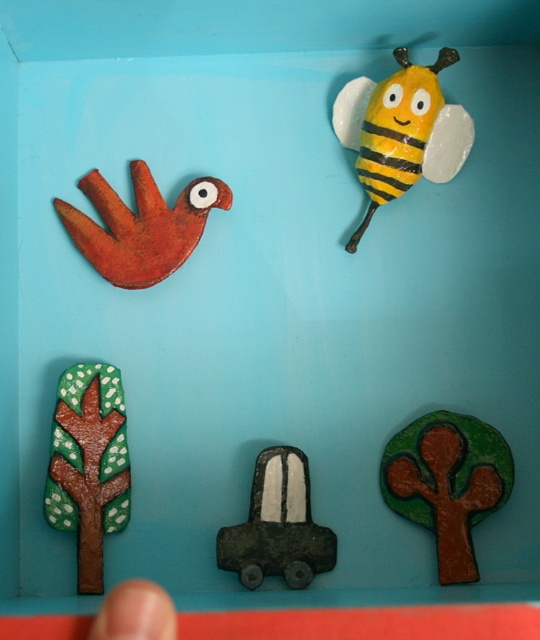
How much distance is there between yellow striped bee at upper right and brown matte tree at lower left?

They are 19.46 inches apart.

Is yellow striped bee at upper right shorter than brown matte tree at lower left?

Yes.

Where is `yellow striped bee at upper right`? yellow striped bee at upper right is located at coordinates (401, 131).

Consider the image. Is the position of green matte tree at lower right more distant than that of matte orange bird at upper left?

No, green matte tree at lower right is in front of matte orange bird at upper left.

Measure the distance from green matte tree at lower right to matte orange bird at upper left.

A distance of 46.60 centimeters exists between green matte tree at lower right and matte orange bird at upper left.

The height and width of the screenshot is (640, 540). What do you see at coordinates (448, 483) in the screenshot?
I see `green matte tree at lower right` at bounding box center [448, 483].

This screenshot has height=640, width=540. I want to click on green matte tree at lower right, so click(448, 483).

Can you confirm if green matte tree at lower right is taller than yellow striped bee at upper right?

No, green matte tree at lower right is not taller than yellow striped bee at upper right.

Does green matte tree at lower right appear on the right side of yellow striped bee at upper right?

Indeed, green matte tree at lower right is positioned on the right side of yellow striped bee at upper right.

Locate an element on the screen. green matte tree at lower right is located at coordinates (448, 483).